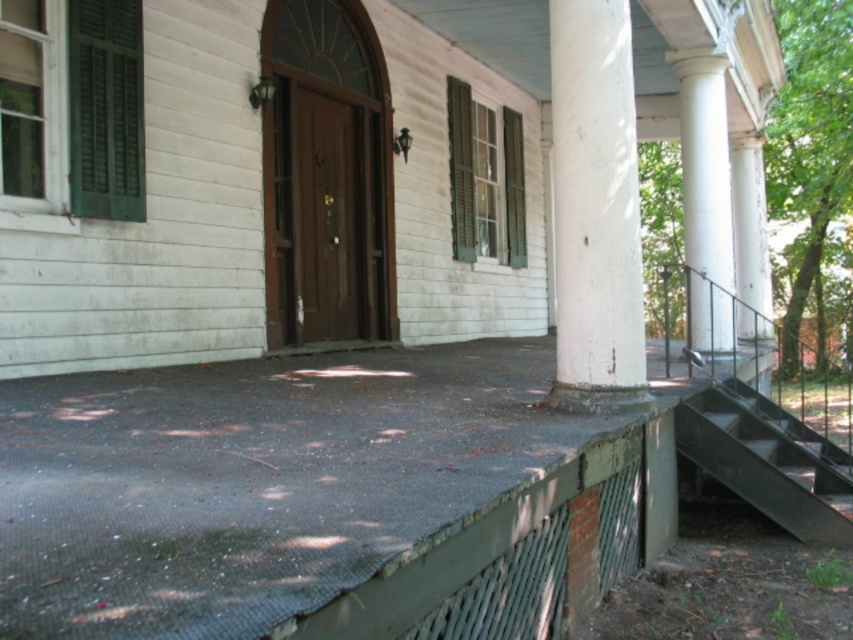
Question: Which of the following is the closest to the observer?

Choices:
 (A) green wood shutters at center
 (B) metallic gray stairs at lower right
 (C) green wood shutter at center

Answer: (B)

Question: Does white painted wood column at right have a smaller size compared to green painted wood shutter at center?

Choices:
 (A) no
 (B) yes

Answer: (A)

Question: Estimate the real-world distances between objects in this image. Which object is farther from the green painted wood shutter at center?

Choices:
 (A) metallic gray stairs at lower right
 (B) green wood shutters at center

Answer: (A)

Question: Is brown wooden door at center above green wood shutter at center?

Choices:
 (A) no
 (B) yes

Answer: (A)

Question: Based on their relative distances, which object is farther from the white smooth column at right?

Choices:
 (A) brown wooden door at center
 (B) green wood shutters at center
 (C) white painted wood column at right
 (D) green matte shutter at left

Answer: (D)

Question: Is white smooth column at center closer to the viewer compared to green wood shutters at center?

Choices:
 (A) yes
 (B) no

Answer: (A)